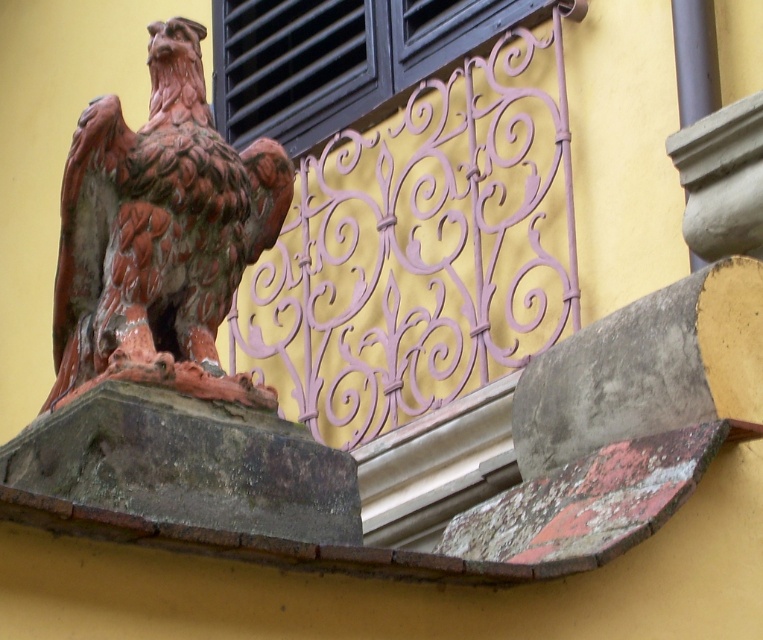
Question: Is rusty metal eagle at left to the right of black matte window at upper center from the viewer's perspective?

Choices:
 (A) yes
 (B) no

Answer: (B)

Question: Which of the following is the farthest from the observer?

Choices:
 (A) (140, 132)
 (B) (359, 16)

Answer: (B)

Question: Which of the following is the farthest from the observer?

Choices:
 (A) black matte window at upper center
 (B) rusty metal eagle at left

Answer: (A)

Question: Is rusty metal eagle at left below black matte window at upper center?

Choices:
 (A) yes
 (B) no

Answer: (A)

Question: Is rusty metal eagle at left to the left of black matte window at upper center from the viewer's perspective?

Choices:
 (A) yes
 (B) no

Answer: (A)

Question: Which point appears farthest from the camera in this image?

Choices:
 (A) (56, 401)
 (B) (324, 100)

Answer: (B)